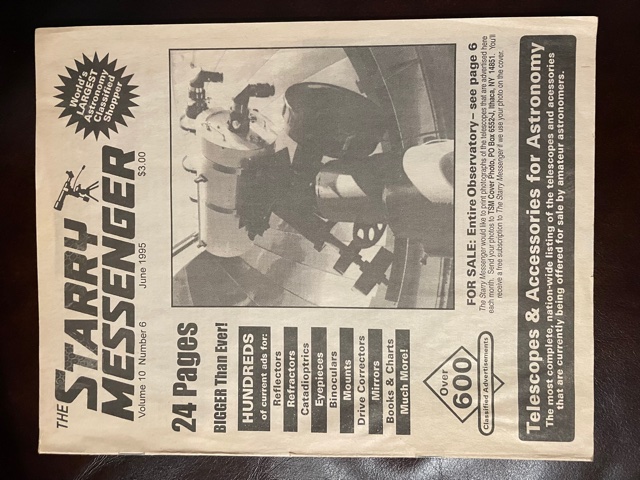
In order to click on table in this screenshot , I will do `click(16, 167)`, `click(6, 238)`, `click(4, 360)`, `click(67, 454)`, `click(393, 462)`.